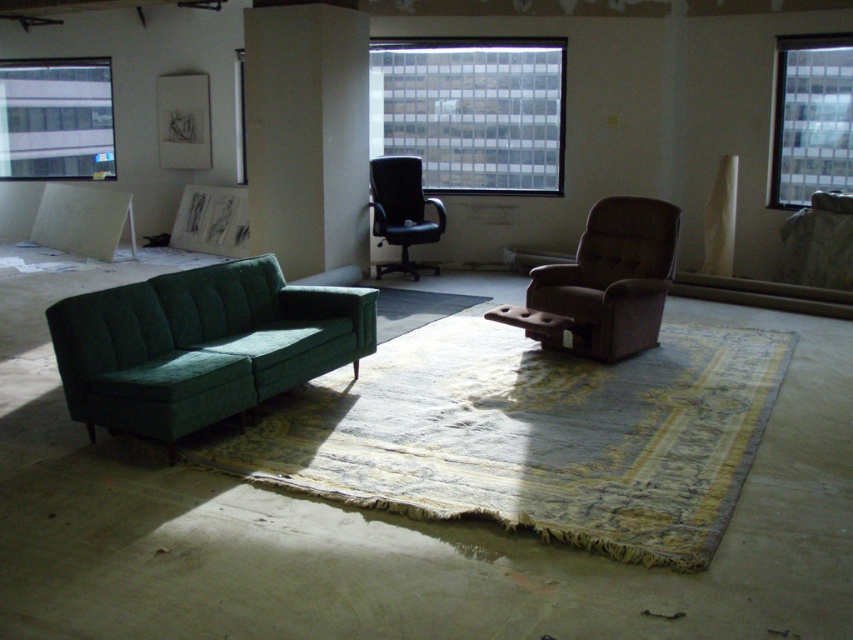
You are moving a large piece of furniture into the room and need to place it near the green fabric couch at upper left and the black leather office chair at center. Which object should you place the new furniture next to if you want to ensure there is enough space?

You should place the new furniture next to the black leather office chair at center because the green fabric couch at upper left is bigger and may take up more space, leaving less room for the new item.

You are standing in the center of the room and want to look outside. Where should you go to see through the clear glass window at center?

The clear glass window at center is located at point (x=471, y=112), so you should move towards that coordinate to see outside.